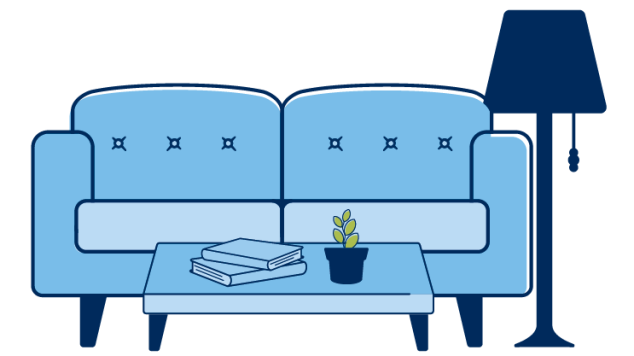
Locate an element on the screen. plant is located at coordinates (347, 264).